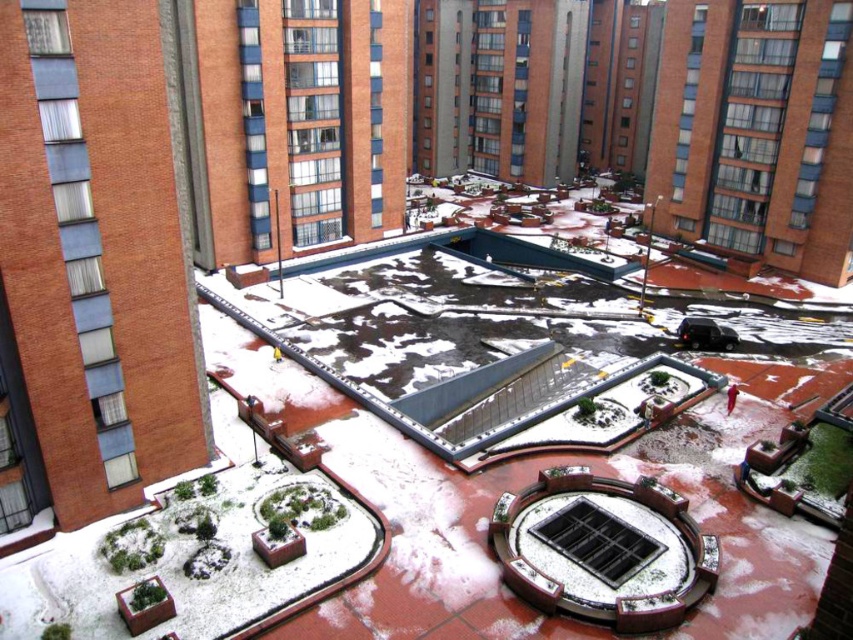
You are standing in the snow covered courtyard. You see a brick building at center represented by point (294, 122). What is the location of the brick building at center?

The brick building at center is located at point (294, 122).

You are standing in the snow covered courtyard and want to take a photo of the brick building at center and the brick building at upper right. Which building will appear larger in the photo?

The brick building at center will appear larger in the photo because it is positioned closer to the camera than the brick building at upper right, which is further away.

You are standing in the snow covered courtyard and want to walk towards the brick building at upper right. Which direction should you move relative to the brick building at center?

To reach the brick building at upper right, you should move to the right of the brick building at center, as the brick building at center is to the left of the brick building at upper right.